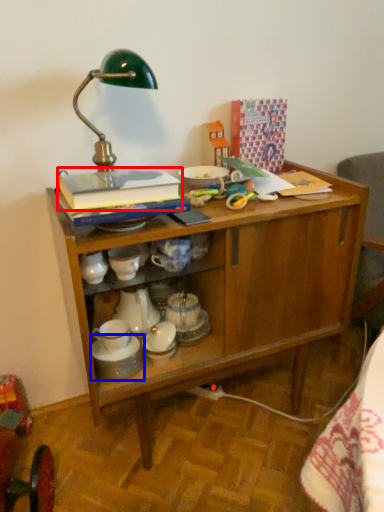
Question: Which point is further to the camera, book (highlighted by a red box) or tableware (highlighted by a blue box)?

Choices:
 (A) book
 (B) tableware

Answer: (B)